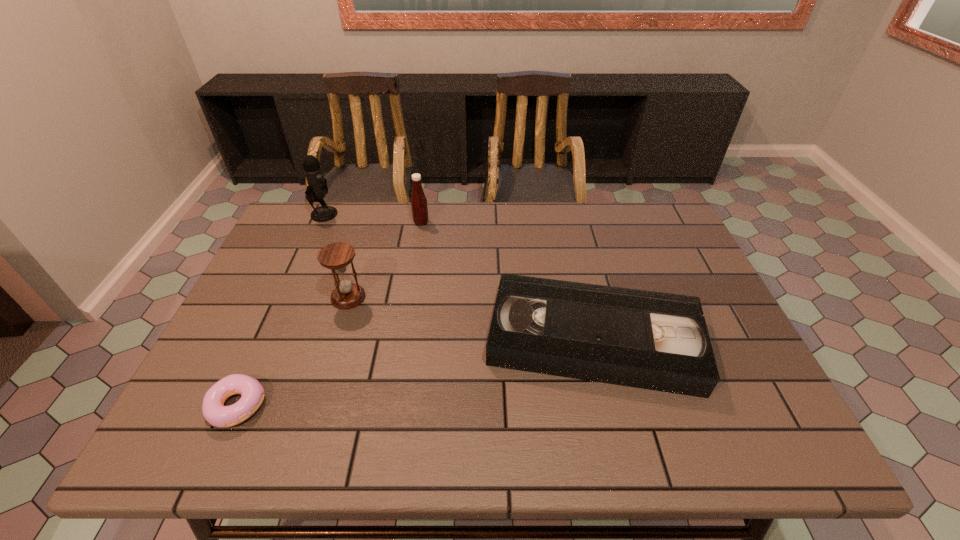
Locate which object is the second closest to the shortest object. Please provide its 2D coordinates. Your answer should be formatted as a tuple, i.e. [(x, y)], where the tuple contains the x and y coordinates of a point satisfying the conditions above.

[(659, 341)]

Identify which object is the closest to the second object from right to left. Please provide its 2D coordinates. Your answer should be formatted as a tuple, i.e. [(x, y)], where the tuple contains the x and y coordinates of a point satisfying the conditions above.

[(317, 188)]

Where is `vacant space that satisfies the following two spatial constraints: 1. on the back side of the Tabasco sauce; 2. on the left side of the hourglass`? Image resolution: width=960 pixels, height=540 pixels. vacant space that satisfies the following two spatial constraints: 1. on the back side of the Tabasco sauce; 2. on the left side of the hourglass is located at coordinates (372, 222).

Locate an element on the screen. The height and width of the screenshot is (540, 960). free spot that satisfies the following two spatial constraints: 1. on the back side of the microphone; 2. on the right side of the doughnut is located at coordinates 323,214.

The height and width of the screenshot is (540, 960). Identify the location of vacant position in the image that satisfies the following two spatial constraints: 1. on the back side of the shortest object; 2. on the right side of the Tabasco sauce. (320, 222).

At what (x,y) coordinates should I click in order to perform the action: click on free space that satisfies the following two spatial constraints: 1. on the front side of the microphone; 2. on the right side of the fourth object from left to right. Please return your answer as a coordinate pair (x, y). Looking at the image, I should click on (320, 222).